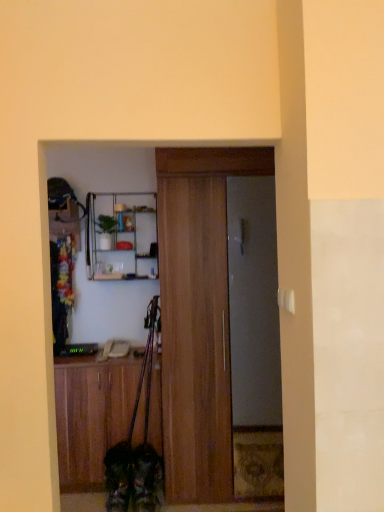
Question: Which is correct: fluffy brown dog at lower center is inside wooden door at center, positioned as the first door in front-to-back order, or outside of it?

Choices:
 (A) outside
 (B) inside

Answer: (A)

Question: Does point (125, 470) appear closer or farther from the camera than point (182, 426)?

Choices:
 (A) closer
 (B) farther

Answer: (A)

Question: Considering the real-world distances, which object is farthest from the wooden cabinet at lower left?

Choices:
 (A) metallic gray door at center, the 1th door in the back-to-front sequence
 (B) wooden door at center, positioned as the first door in front-to-back order
 (C) metallic silver shelf at upper center
 (D) fluffy brown dog at lower center

Answer: (A)

Question: Estimate the real-world distances between objects in this image. Which object is closer to the wooden door at center, positioned as the first door in front-to-back order?

Choices:
 (A) metallic silver shelf at upper center
 (B) metallic gray door at center, the 2th door when ordered from front to back
 (C) fluffy brown dog at lower center
 (D) wooden cabinet at lower left

Answer: (B)